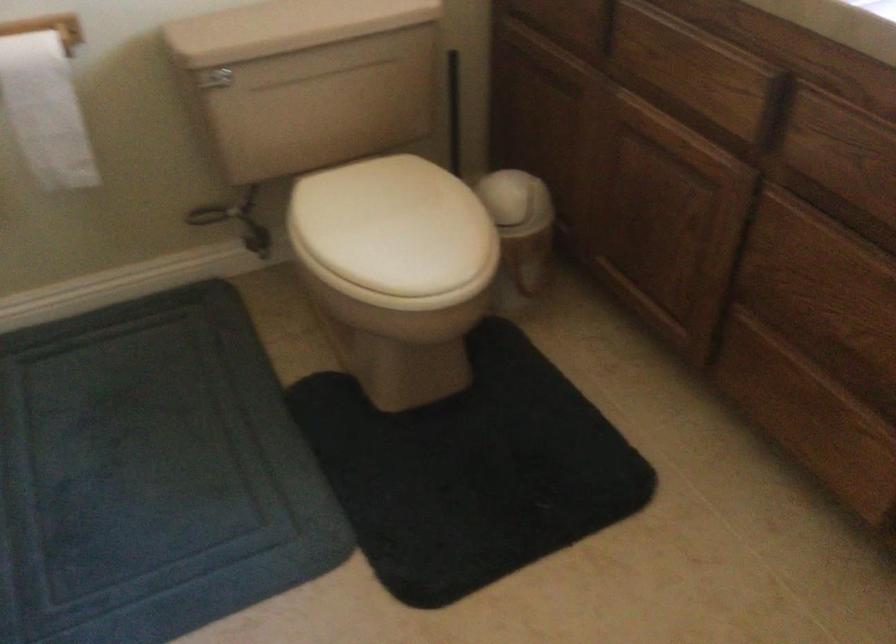
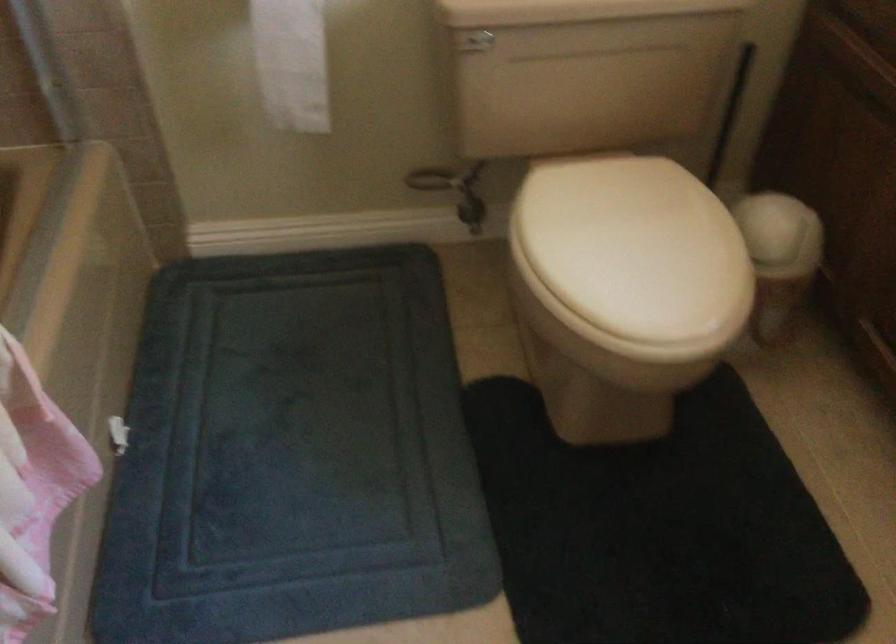
Where in the second image is the point corresponding to the point at 220,80 from the first image?

(475, 41)